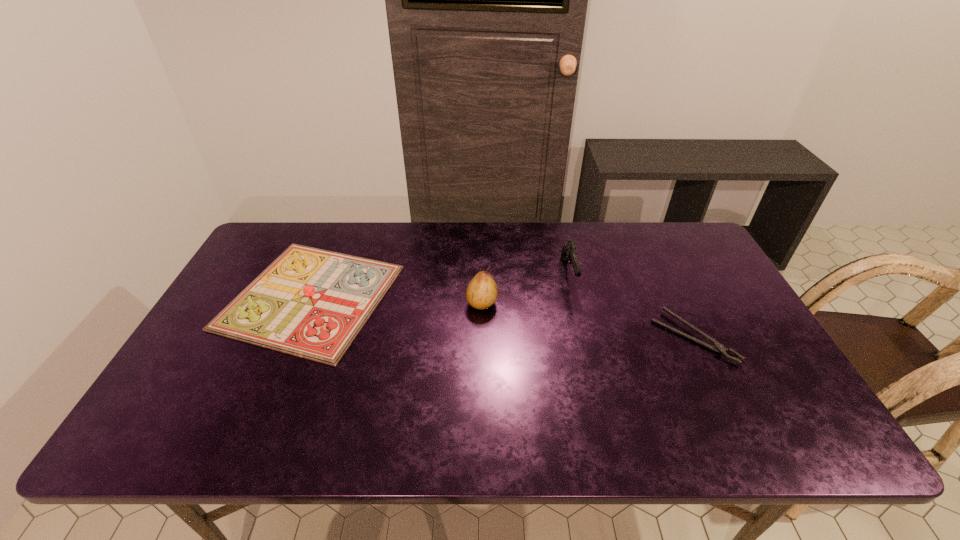
Where is `blank region between the second object from left to right and the third object from left to right`? blank region between the second object from left to right and the third object from left to right is located at coordinates (525, 289).

Where is `empty space between the gameboard and the shortest object`? empty space between the gameboard and the shortest object is located at coordinates click(502, 317).

The height and width of the screenshot is (540, 960). I want to click on free spot between the rightmost object and the pear, so click(588, 320).

At what (x,y) coordinates should I click in order to perform the action: click on free space that is in between the rightmost object and the third object from right to left. Please return your answer as a coordinate pair (x, y). Image resolution: width=960 pixels, height=540 pixels. Looking at the image, I should click on (588, 320).

The image size is (960, 540). I want to click on vacant space that is in between the third object from right to left and the leftmost object, so click(x=396, y=300).

Locate an element on the screen. This screenshot has width=960, height=540. free area in between the gameboard and the pear is located at coordinates (396, 300).

Locate an element on the screen. This screenshot has width=960, height=540. vacant area that lies between the gun and the shortest object is located at coordinates (631, 306).

Identify the location of free spot between the rightmost object and the pear. The height and width of the screenshot is (540, 960). (588, 320).

Image resolution: width=960 pixels, height=540 pixels. Find the location of `free area in between the third object from right to left and the tongs`. free area in between the third object from right to left and the tongs is located at coordinates (588, 320).

Where is `vacant area between the gameboard and the second object from left to right`? vacant area between the gameboard and the second object from left to right is located at coordinates (396, 300).